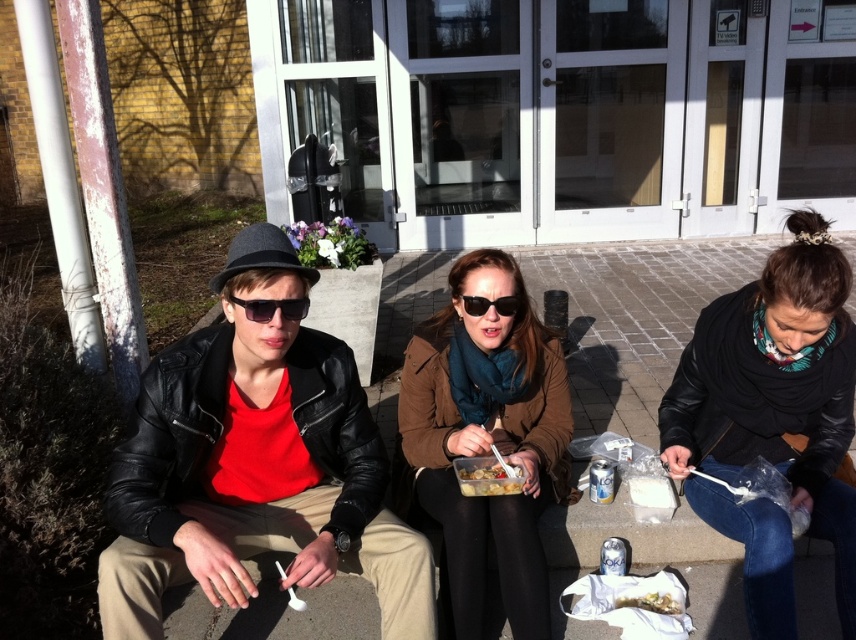
Which is more to the right, leather jacket at center or brown matte jacket at center?

brown matte jacket at center is more to the right.

The image size is (856, 640). Describe the element at coordinates (215, 467) in the screenshot. I see `leather jacket at center` at that location.

Is point (506, 602) behind point (462, 381)?

No, (506, 602) is in front of (462, 381).

At what (x,y) coordinates should I click in order to perform the action: click on leather jacket at center. Please return your answer as a coordinate pair (x, y). The height and width of the screenshot is (640, 856). Looking at the image, I should click on (215, 467).

Is brown matte jacket at center behind translucent plastic container at center?

That is False.

Between brown matte jacket at center and translucent plastic container at center, which one is positioned lower?

Positioned lower is translucent plastic container at center.

Where is `brown matte jacket at center`? brown matte jacket at center is located at coordinates (485, 440).

Is the position of black leather jacket at lower right more distant than that of brown matte jacket at center?

No.

Does black leather jacket at lower right have a lesser width compared to brown matte jacket at center?

Yes, black leather jacket at lower right is thinner than brown matte jacket at center.

Image resolution: width=856 pixels, height=640 pixels. I want to click on black leather jacket at lower right, so click(x=771, y=417).